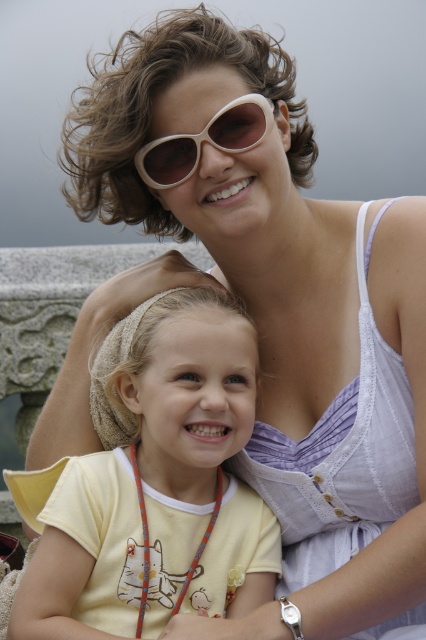
Is point (98, 509) farther from camera compared to point (163, 168)?

No, (98, 509) is closer to viewer.

Can you confirm if yellow cotton shirt at center is bigger than beige plastic sunglasses at upper center?

Indeed, yellow cotton shirt at center has a larger size compared to beige plastic sunglasses at upper center.

Which is behind, point (262, 560) or point (258, 109)?

The point (258, 109) is behind.

The height and width of the screenshot is (640, 426). Identify the location of yellow cotton shirt at center. (155, 490).